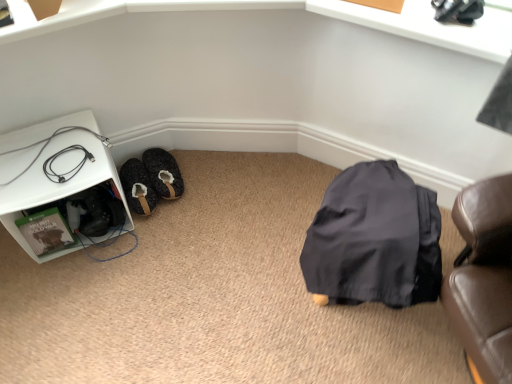
This screenshot has width=512, height=384. I want to click on free area behind black rubber cable at lower left, so click(x=72, y=134).